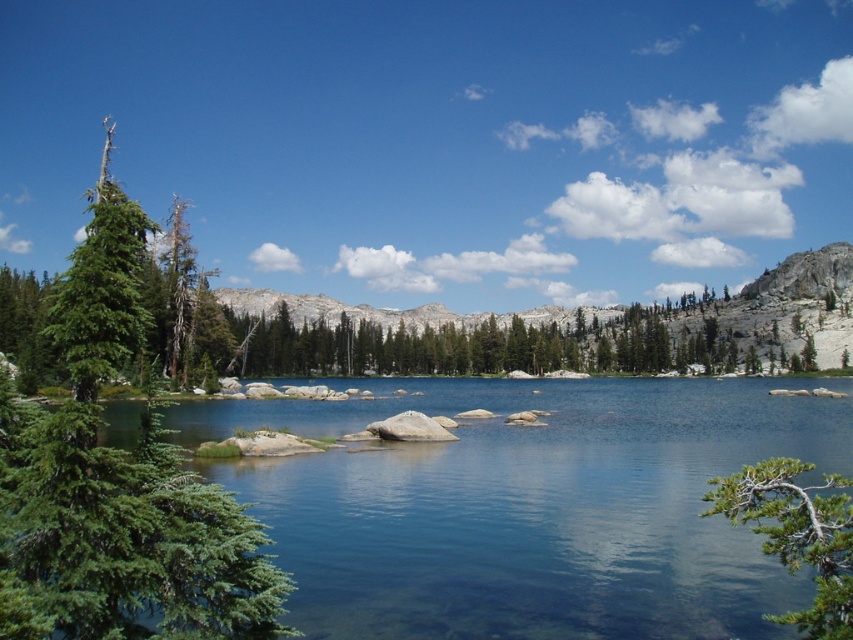
Looking at the serene natural landscape, you see clear water at center and a green textured branch at lower right. Which object is positioned to the left of the other?

The clear water at center is to the left of the green textured branch at lower right.

You are a hiker planning to cross the lake using a wooden plank that is 25 meters long. You see the clear water at center and the green textured branch at lower right. Can you safely place the plank between them to cross?

The distance between the clear water at center and the green textured branch at lower right is 27.86 meters. Since the wooden plank is only 25 meters long, it is too short to span the gap. You cannot safely place the plank between them to cross.